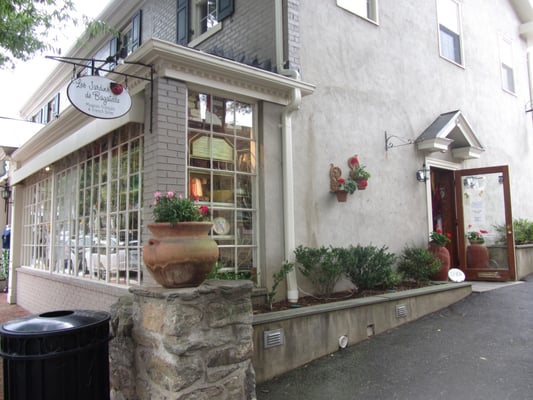
You are a GUI agent. You are given a task and a screenshot of the screen. Output one action in this format:
    pyautogui.click(x=<x>, y=<y>)
    Task: Click on the door
    The image size is (533, 400).
    Given the screenshot: What is the action you would take?
    pyautogui.click(x=477, y=223), pyautogui.click(x=450, y=218)